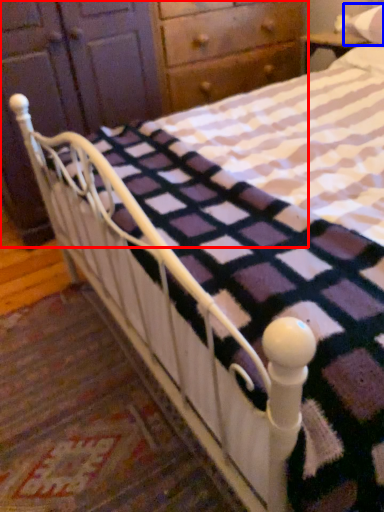
Question: Which object appears farthest to the camera in this image, dresser (highlighted by a red box) or pillow (highlighted by a blue box)?

Choices:
 (A) dresser
 (B) pillow

Answer: (B)